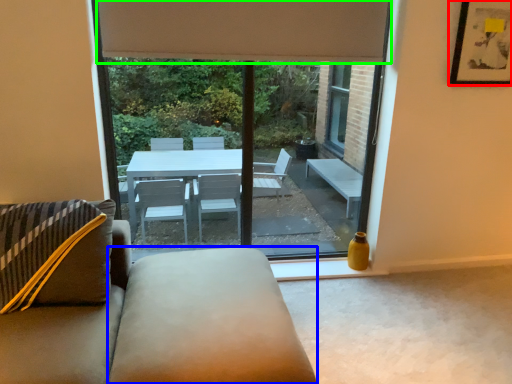
Question: Which object is the farthest from picture frame (highlighted by a red box)? Choose among these: flat (highlighted by a blue box) or curtain (highlighted by a green box).

Choices:
 (A) flat
 (B) curtain

Answer: (A)